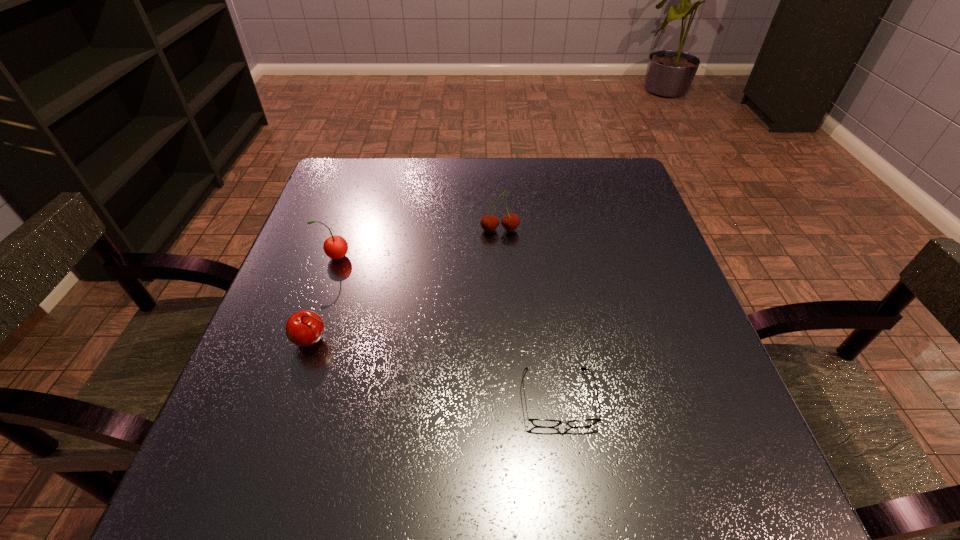
This screenshot has height=540, width=960. What are the coordinates of `vacant region located on the front-facing side of the spectacles` in the screenshot? It's located at (572, 498).

Where is `vacant space at the far edge of the desktop`? This screenshot has width=960, height=540. vacant space at the far edge of the desktop is located at coordinates (475, 177).

I want to click on vacant space at the left edge of the desktop, so click(342, 285).

In the image, there is a desktop. Identify the location of vacant space at the right edge. (710, 422).

Locate an element on the screen. unoccupied position between the farthest object and the third farthest object is located at coordinates (406, 286).

This screenshot has height=540, width=960. In order to click on free area in between the farthest cherry and the spectacles in this screenshot , I will do `click(529, 314)`.

You are a GUI agent. You are given a task and a screenshot of the screen. Output one action in this format:
    pyautogui.click(x=<x>, y=<y>)
    Task: Click on the empty location between the shortest cherry and the second farthest object
    The width and height of the screenshot is (960, 540).
    Given the screenshot: What is the action you would take?
    pyautogui.click(x=324, y=299)

Where is `empty location between the shortest object and the rightmost cherry`? This screenshot has height=540, width=960. empty location between the shortest object and the rightmost cherry is located at coordinates (529, 314).

You are a GUI agent. You are given a task and a screenshot of the screen. Output one action in this format:
    pyautogui.click(x=<x>, y=<y>)
    Task: Click on the free point between the rightmost cherry and the second nearest cherry
    The width and height of the screenshot is (960, 540).
    Given the screenshot: What is the action you would take?
    pyautogui.click(x=418, y=244)

Image resolution: width=960 pixels, height=540 pixels. Identify the location of empty location between the second shortest object and the rightmost cherry. (406, 286).